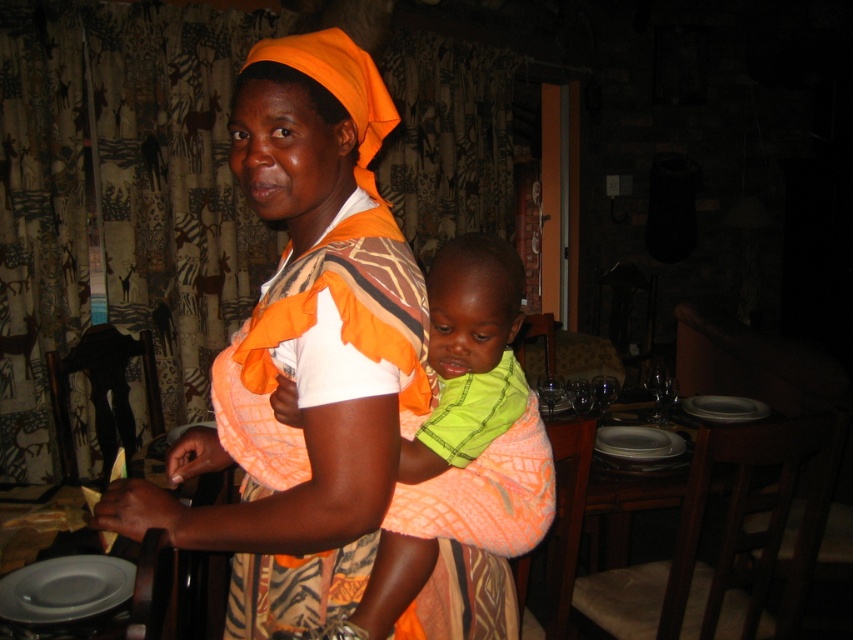
Question: Considering the relative positions of neon green fabric at center and white glossy plate at center in the image provided, where is neon green fabric at center located with respect to white glossy plate at center?

Choices:
 (A) right
 (B) left

Answer: (B)

Question: Which point is farther to the camera?

Choices:
 (A) (267, 476)
 (B) (302, 278)

Answer: (A)

Question: Is matte orange headscarf at center smaller than white glossy plate at lower right?

Choices:
 (A) no
 (B) yes

Answer: (A)

Question: Which point is closer to the camera?

Choices:
 (A) (323, 424)
 (B) (641, 426)
 (C) (508, 483)

Answer: (A)

Question: Is matte gray platter at lower left to the right of white glossy plate at center from the viewer's perspective?

Choices:
 (A) no
 (B) yes

Answer: (A)

Question: Which is farther from the white glossy plate at center?

Choices:
 (A) white glossy plate at lower right
 (B) neon green fabric at center

Answer: (B)